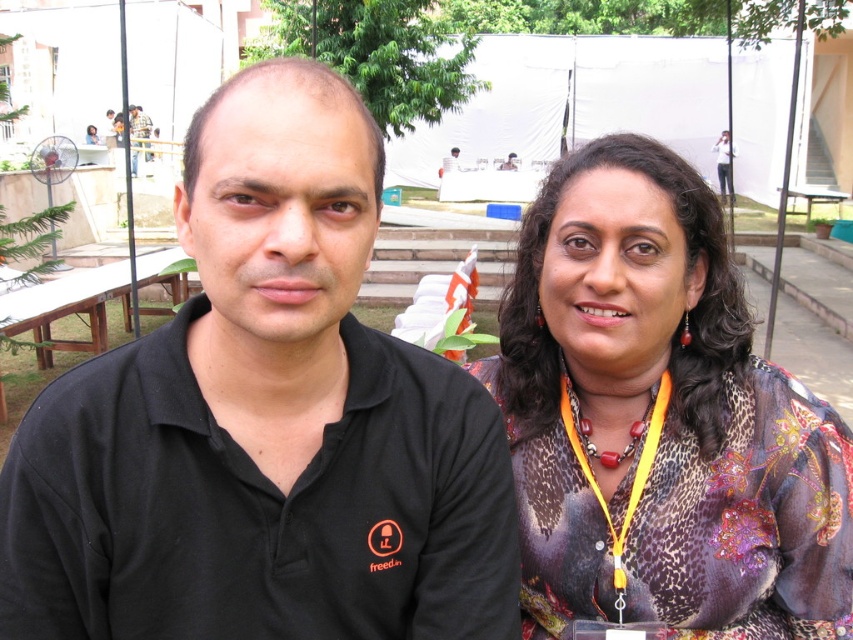
Where is `matte black shirt at center`? The image size is (853, 640). matte black shirt at center is located at coordinates (132, 132).

Does matte black shirt at center have a smaller size compared to red beaded necklace at center?

No, matte black shirt at center is not smaller than red beaded necklace at center.

Which is behind, point (138, 120) or point (593, 448)?

The point (138, 120) is more distant.

I want to click on matte black shirt at center, so click(132, 132).

Is point (537, 488) farther from viewer compared to point (117, 113)?

No, (537, 488) is closer to viewer.

Image resolution: width=853 pixels, height=640 pixels. What do you see at coordinates (660, 417) in the screenshot?
I see `printed silk blouse at center` at bounding box center [660, 417].

Does point (640, 560) come behind point (131, 163)?

No, it is in front of (131, 163).

Locate an element on the screen. The width and height of the screenshot is (853, 640). printed silk blouse at center is located at coordinates (660, 417).

Can you confirm if black matte shirt at left is positioned below printed silk blouse at center?

No, black matte shirt at left is not below printed silk blouse at center.

Does black matte shirt at left appear on the left side of printed silk blouse at center?

Indeed, black matte shirt at left is positioned on the left side of printed silk blouse at center.

The height and width of the screenshot is (640, 853). What do you see at coordinates (264, 422) in the screenshot?
I see `black matte shirt at left` at bounding box center [264, 422].

Image resolution: width=853 pixels, height=640 pixels. Find the location of `black matte shirt at left`. black matte shirt at left is located at coordinates (264, 422).